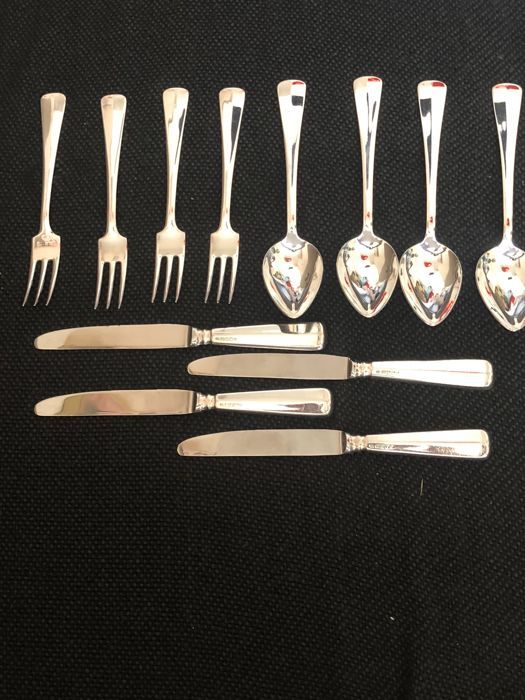
The width and height of the screenshot is (525, 700). I want to click on spoons, so click(x=306, y=260), click(x=385, y=262), click(x=415, y=264), click(x=500, y=265).